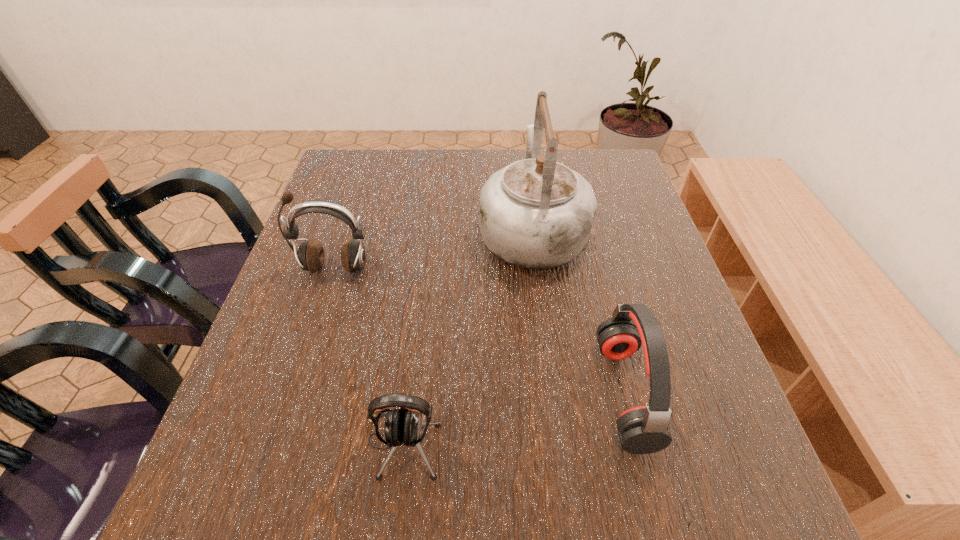
What are the coordinates of `vacant area that lies between the leftmost object and the second earphone from left to right` in the screenshot? It's located at (369, 355).

The width and height of the screenshot is (960, 540). In order to click on free point between the rightmost earphone and the tallest object in this screenshot , I will do `click(578, 311)`.

Where is `vacant region between the leftmost earphone and the second earphone from right to left`? This screenshot has width=960, height=540. vacant region between the leftmost earphone and the second earphone from right to left is located at coordinates (369, 355).

Identify the location of free space between the second earphone from right to left and the rightmost earphone. The image size is (960, 540). (514, 418).

At what (x,y) coordinates should I click in order to perform the action: click on object that is the closest to the farthest earphone. Please return your answer as a coordinate pair (x, y). The image size is (960, 540). Looking at the image, I should click on (536, 213).

Identify which object is the second nearest to the farthest earphone. Please provide its 2D coordinates. Your answer should be formatted as a tuple, i.e. [(x, y)], where the tuple contains the x and y coordinates of a point satisfying the conditions above.

[(402, 426)]

Choose which earphone is the nearest neighbor to the leftmost earphone. Please provide its 2D coordinates. Your answer should be formatted as a tuple, i.e. [(x, y)], where the tuple contains the x and y coordinates of a point satisfying the conditions above.

[(402, 426)]

Choose which earphone is the nearest neighbor to the rightmost earphone. Please provide its 2D coordinates. Your answer should be formatted as a tuple, i.e. [(x, y)], where the tuple contains the x and y coordinates of a point satisfying the conditions above.

[(402, 426)]

This screenshot has height=540, width=960. Find the location of `free region that satisfies the following two spatial constraints: 1. on the ear cups of the rightmost earphone; 2. on the front side of the second earphone from left to right`. free region that satisfies the following two spatial constraints: 1. on the ear cups of the rightmost earphone; 2. on the front side of the second earphone from left to right is located at coordinates (637, 443).

This screenshot has height=540, width=960. What are the coordinates of `vacant space that satisfies the following two spatial constraints: 1. on the ear pads of the second earphone from right to left; 2. on the left side of the farthest earphone` in the screenshot? It's located at (277, 443).